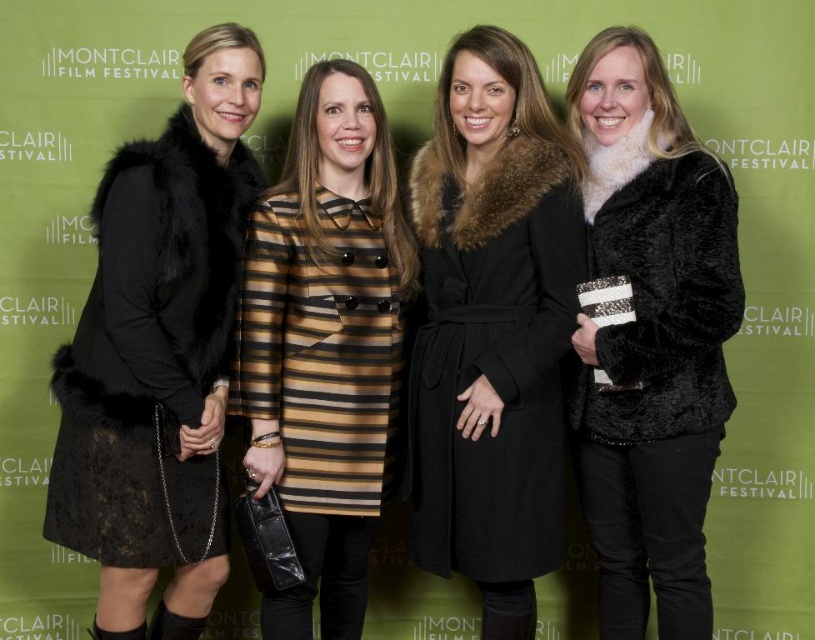
Can you confirm if fuzzy black coat at right is smaller than striped fabric dress at center?

No.

Which of these two, fuzzy black coat at right or striped fabric dress at center, stands shorter?

striped fabric dress at center

Image resolution: width=815 pixels, height=640 pixels. Identify the location of fuzzy black coat at right. (652, 337).

Can you confirm if fuzzy black coat at right is bigger than black leather boot at lower left?

Correct, fuzzy black coat at right is larger in size than black leather boot at lower left.

Who is more forward, [598,468] or [170,620]?

Point [170,620]

This screenshot has width=815, height=640. I want to click on fuzzy black coat at right, so click(652, 337).

Locate an element on the screen. Image resolution: width=815 pixels, height=640 pixels. velvet black dress at left is located at coordinates (159, 346).

What do you see at coordinates (159, 346) in the screenshot? This screenshot has width=815, height=640. I see `velvet black dress at left` at bounding box center [159, 346].

This screenshot has width=815, height=640. In order to click on velvet black dress at left in this screenshot , I will do `click(159, 346)`.